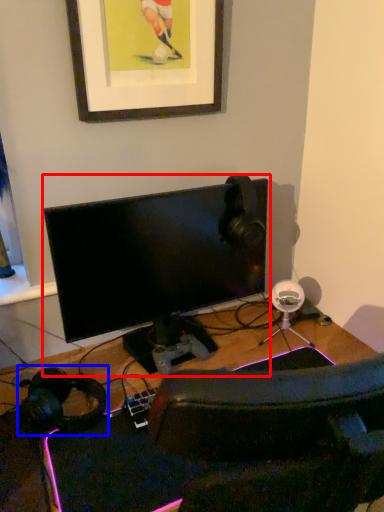
Question: Which of the following is the closest to the observer, computer monitor (highlighted by a red box) or headphones (highlighted by a blue box)?

Choices:
 (A) computer monitor
 (B) headphones

Answer: (B)